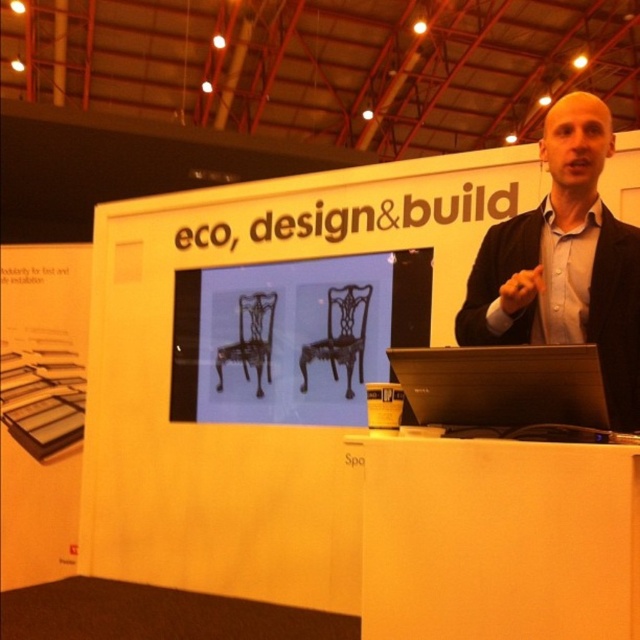
Does black wrought iron chairs at center have a greater width compared to black matte laptop at center?

Correct, the width of black wrought iron chairs at center exceeds that of black matte laptop at center.

Can you confirm if black wrought iron chairs at center is positioned below black matte laptop at center?

Incorrect, black wrought iron chairs at center is not positioned below black matte laptop at center.

Is point (403, 294) positioned in front of point (604, 406)?

No, (403, 294) is behind (604, 406).

The height and width of the screenshot is (640, 640). Identify the location of black wrought iron chairs at center. (292, 337).

Can you confirm if black wrought iron chairs at center is shorter than black suit at upper right?

No.

Does black wrought iron chairs at center appear under black suit at upper right?

Yes, black wrought iron chairs at center is below black suit at upper right.

Locate an element on the screen. Image resolution: width=640 pixels, height=640 pixels. black wrought iron chairs at center is located at coordinates (292, 337).

At what (x,y) coordinates should I click in order to perform the action: click on black suit at upper right. Please return your answer as a coordinate pair (x, y). The image size is (640, 640). Looking at the image, I should click on (564, 262).

Is black suit at upper right to the left of black matte laptop at center from the viewer's perspective?

No, black suit at upper right is not to the left of black matte laptop at center.

You are a GUI agent. You are given a task and a screenshot of the screen. Output one action in this format:
    pyautogui.click(x=<x>, y=<y>)
    Task: Click on the black suit at upper right
    The height and width of the screenshot is (640, 640).
    Given the screenshot: What is the action you would take?
    pyautogui.click(x=564, y=262)

Identify the location of black suit at upper right. (564, 262).